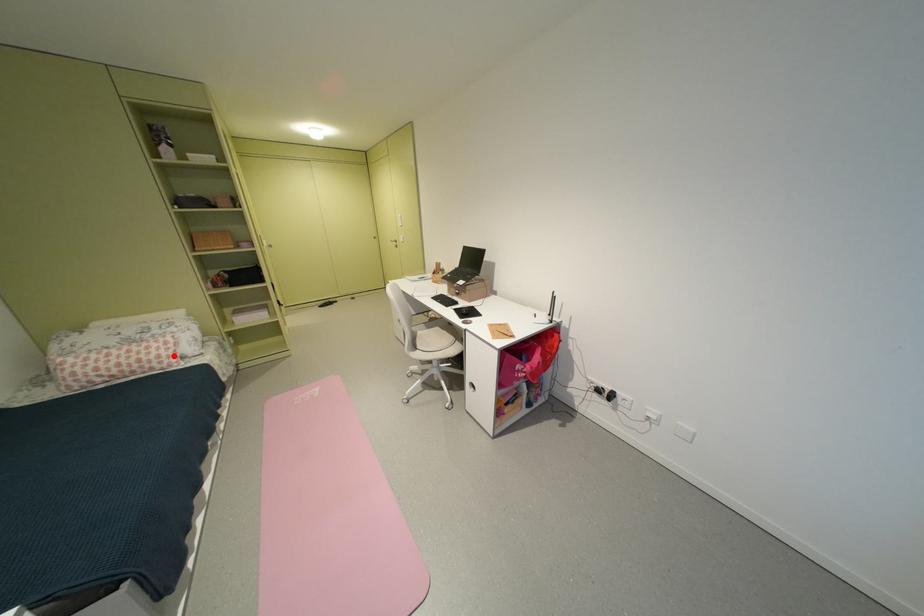
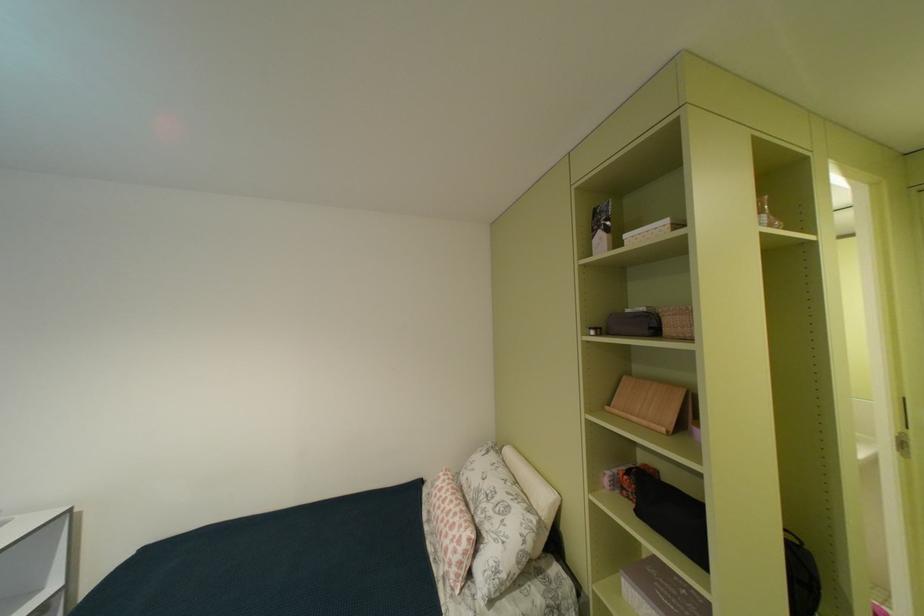
Locate, in the second image, the point that corresponds to the highlighted location in the first image.

(458, 556)